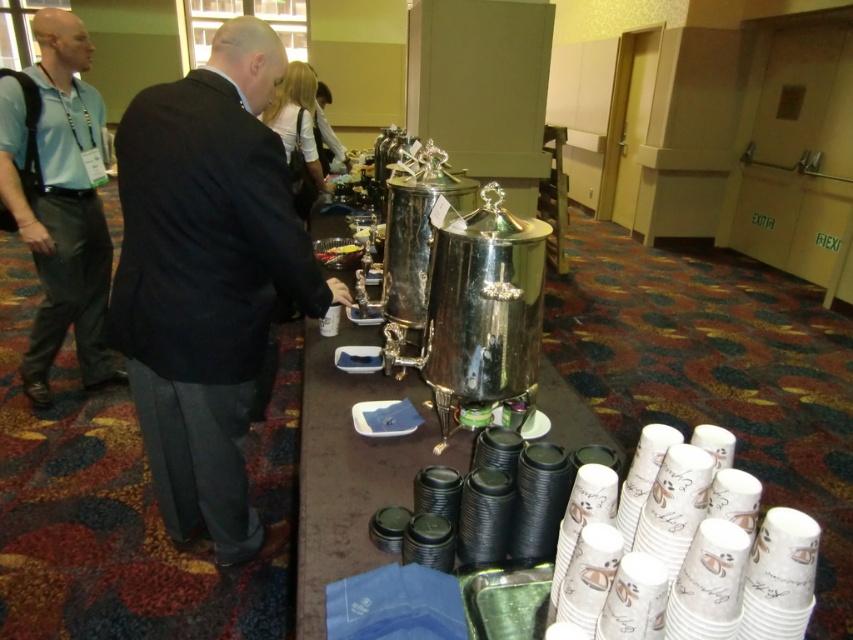
How far apart are matte blue shirt at left and shiny silver tray at center?

3.67 feet

Which of these two, matte blue shirt at left or shiny silver tray at center, stands shorter?

shiny silver tray at center

Which is in front, point (73, 64) or point (326, 264)?

Positioned in front is point (326, 264).

You are a GUI agent. You are given a task and a screenshot of the screen. Output one action in this format:
    pyautogui.click(x=<x>, y=<y>)
    Task: Click on the matte blue shirt at left
    The height and width of the screenshot is (640, 853).
    Given the screenshot: What is the action you would take?
    pyautogui.click(x=61, y=202)

Does black suit at center appear on the left side of shiny silver tray at center?

Indeed, black suit at center is positioned on the left side of shiny silver tray at center.

Find the location of a particular element. The width and height of the screenshot is (853, 640). black suit at center is located at coordinates (207, 280).

Between point (228, 20) and point (318, 259), which one is positioned behind?

Point (318, 259)

Where is `black suit at center`? The width and height of the screenshot is (853, 640). black suit at center is located at coordinates (207, 280).

Does polished silver coffee pot at center have a greater width compared to shiny silver tray at center?

Correct, the width of polished silver coffee pot at center exceeds that of shiny silver tray at center.

Is polished silver coffee pot at center shorter than shiny silver tray at center?

No.

In order to click on polished silver coffee pot at center in this screenshot , I will do `click(352, 467)`.

Find the location of a particular element. The height and width of the screenshot is (640, 853). polished silver coffee pot at center is located at coordinates point(352,467).